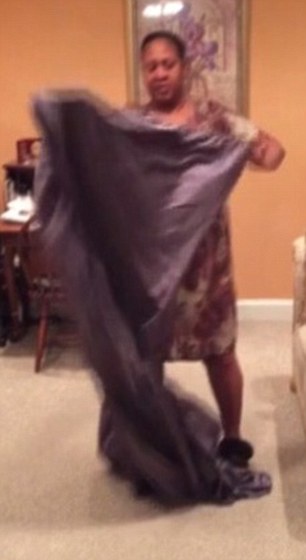
Where is `floor`? Image resolution: width=306 pixels, height=560 pixels. floor is located at coordinates (44, 452).